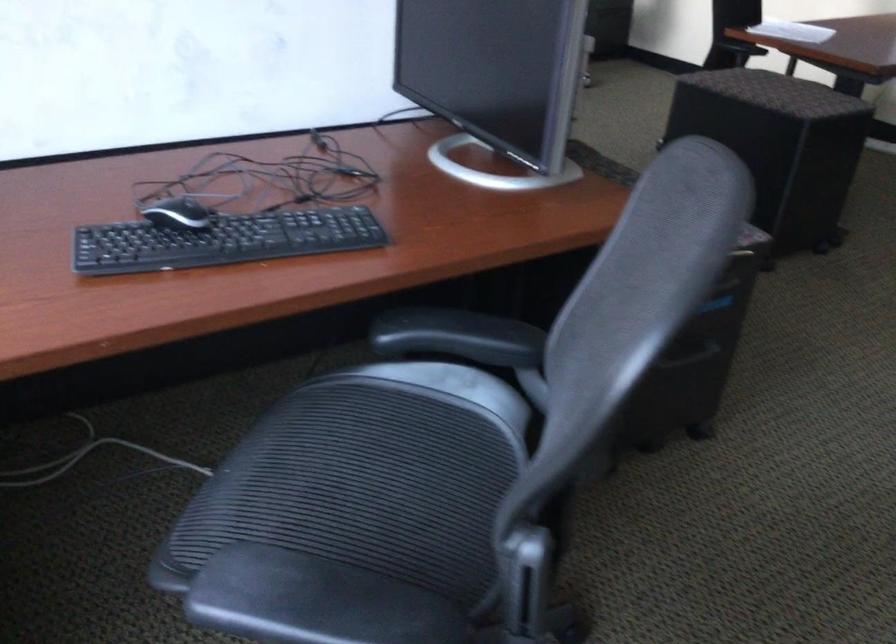
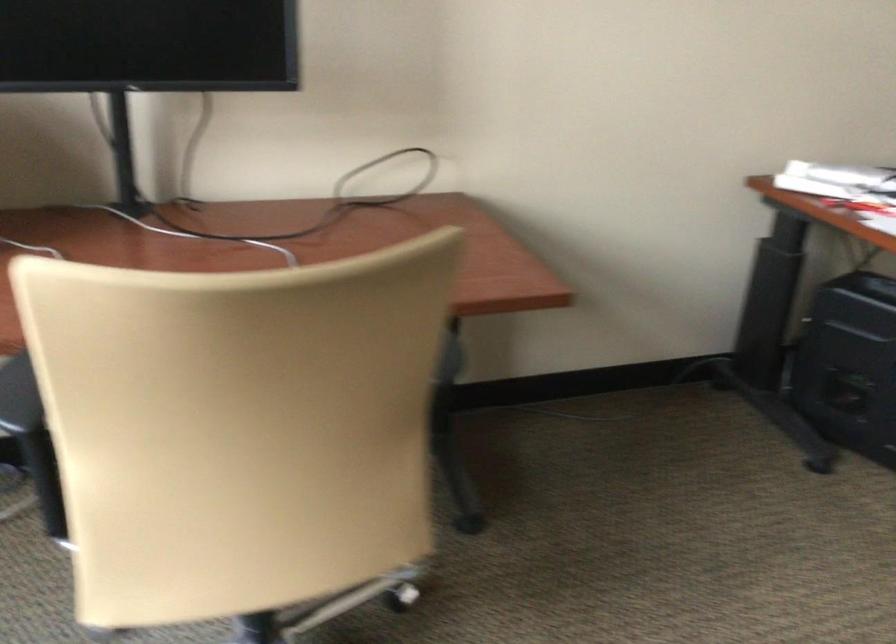
Question: The images are taken continuously from a first-person perspective. In which direction are you moving?

Choices:
 (A) Left
 (B) Right
 (C) Forward
 (D) Backward

Answer: (C)